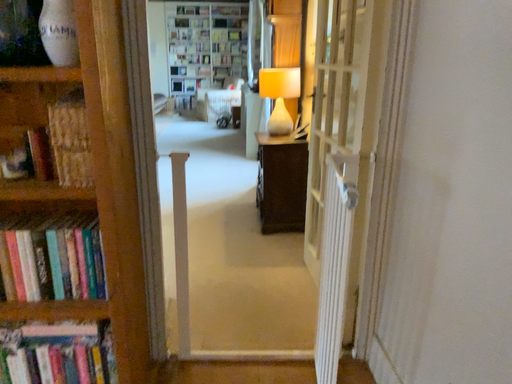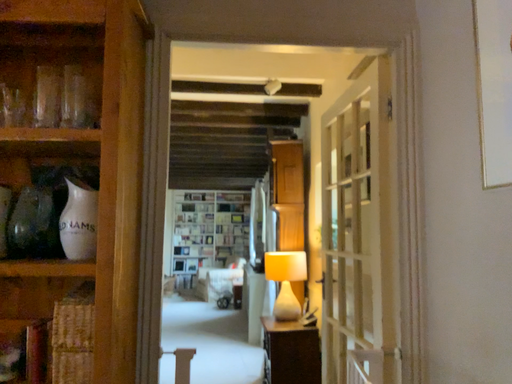
Question: Which way did the camera rotate in the video?

Choices:
 (A) rotated upward
 (B) rotated downward

Answer: (A)